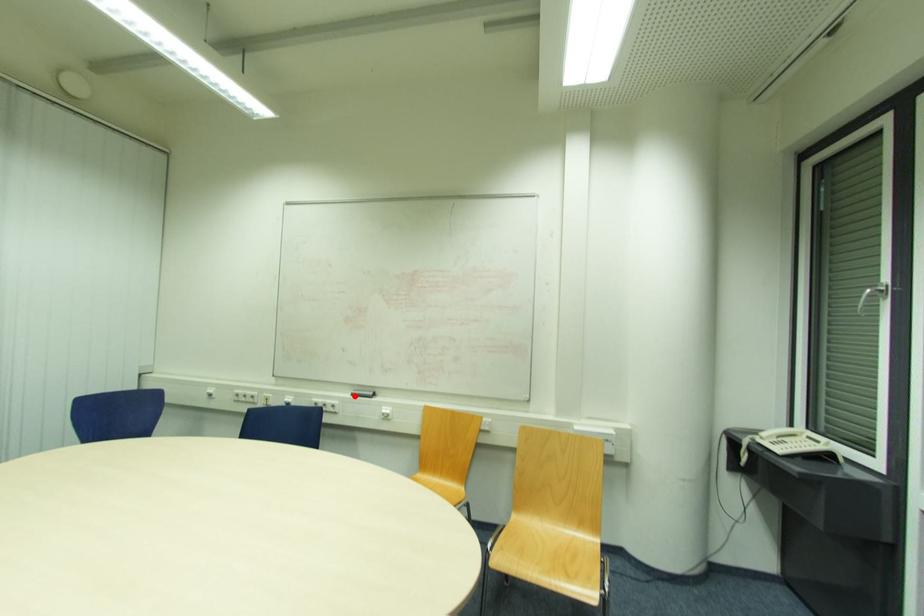
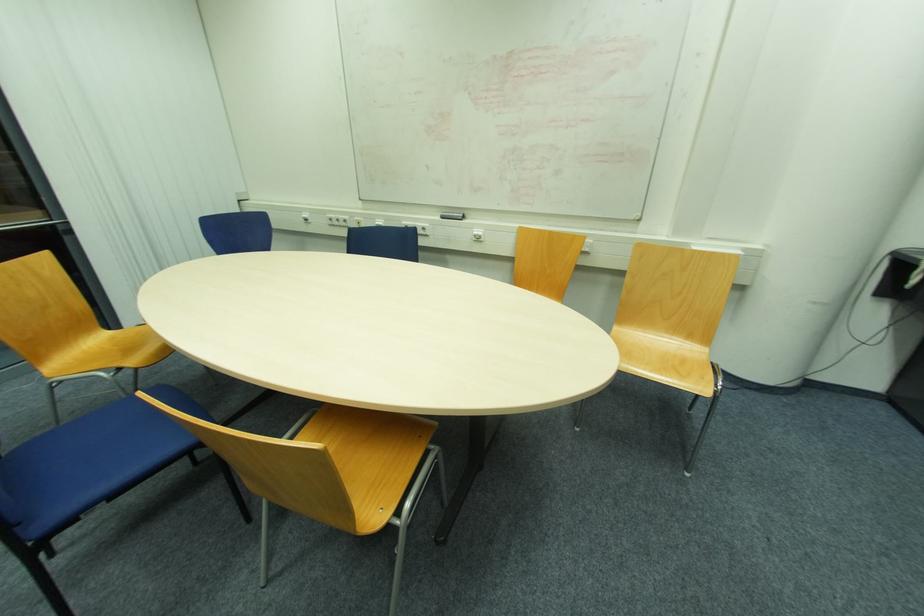
Find the pixel in the second image that matches the highlighted location in the first image.

(444, 217)